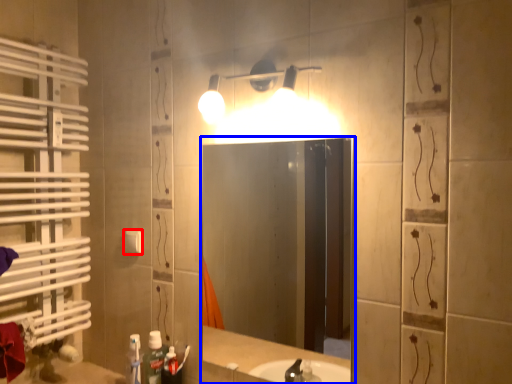
Question: Among these objects, which one is farthest to the camera, light switch (highlighted by a red box) or mirror (highlighted by a blue box)?

Choices:
 (A) light switch
 (B) mirror

Answer: (A)